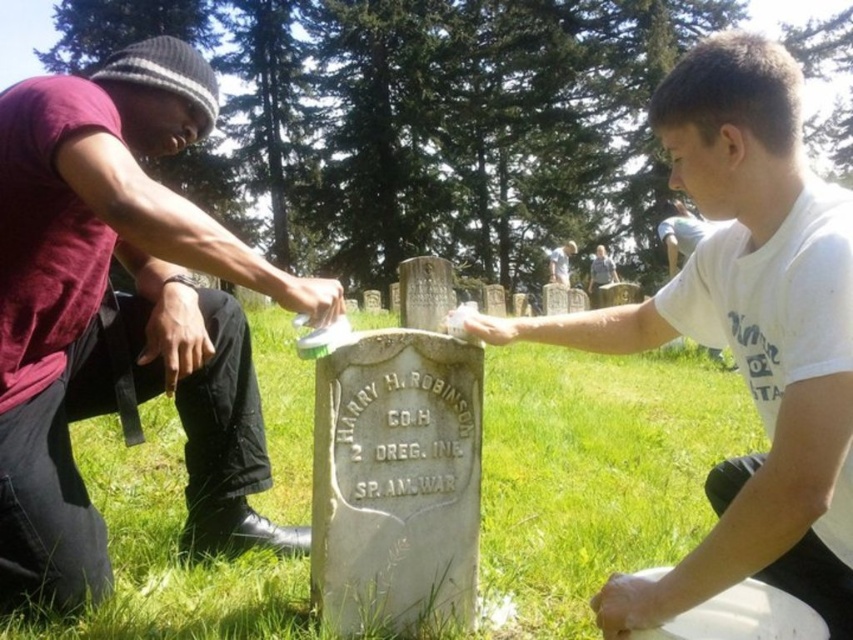
You are a visitor at the cemetery and want to take a photo of both the white matte stone at center and the light gray stone headstone at center. Which one should you focus on first to ensure both are in frame?

The white matte stone at center is positioned under the light gray stone headstone at center, so you should focus on the light gray stone headstone at center first to ensure both are in frame.

You are standing in a cemetery and want to clean the white matte stone at center. If you are 1.19 meters away from it, can you reach it without moving closer?

The white matte stone at center is 1.19 meters away from the viewer. Since the average human arm length is about 0.7 meters, you cannot reach it without moving closer.

Based on the scene description, where is the maroon cotton shirt at left located in the image?

The maroon cotton shirt at left is located at the 2D coordinates point (x=117, y=316) in the image.